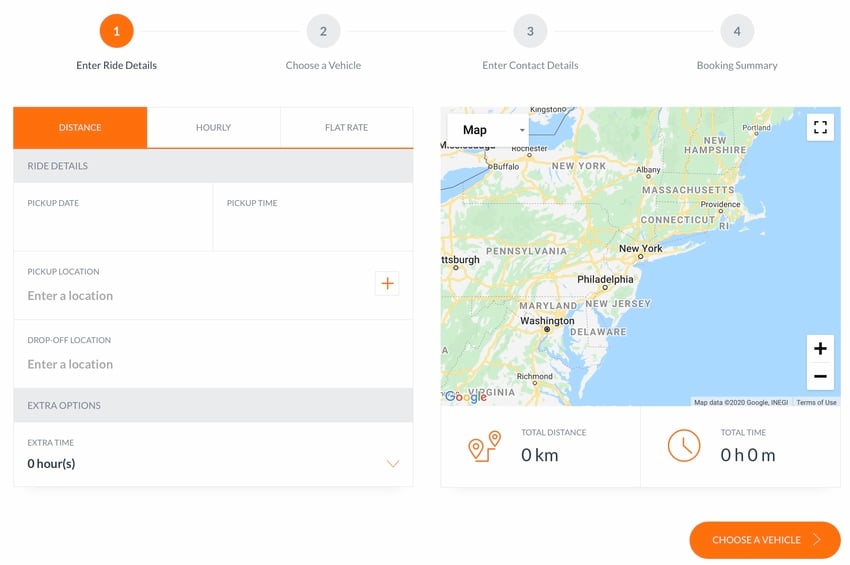
Find the location of a particular element. This screenshot has height=565, width=850. clock is located at coordinates coord(677,447).